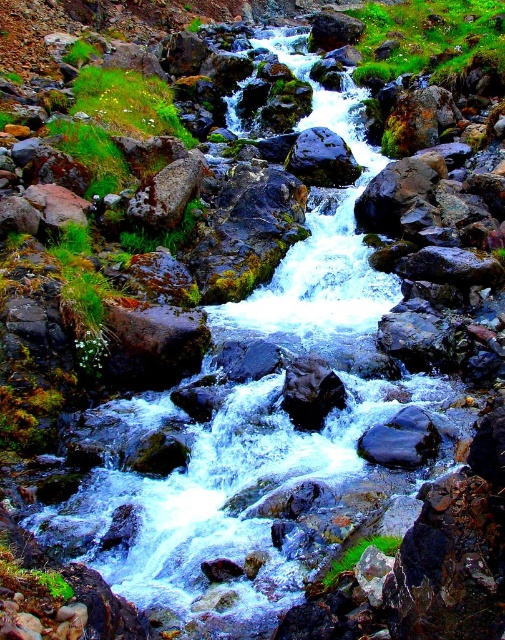
Between green mossy rock at center-left and shiny dark rock at center, which one is positioned lower?

green mossy rock at center-left is lower down.

Who is taller, green mossy rock at center-left or shiny dark rock at center?

Standing taller between the two is shiny dark rock at center.

Describe the element at coordinates (168, 193) in the screenshot. I see `green mossy rock at center-left` at that location.

Identify the location of green mossy rock at center-left. Image resolution: width=505 pixels, height=640 pixels. (168, 193).